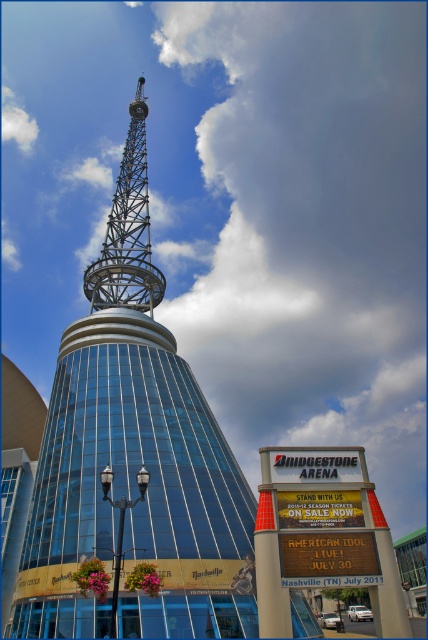
Question: Does metallic structure at upper center appear on the right side of metallic lattice tower at upper center?

Choices:
 (A) no
 (B) yes

Answer: (A)

Question: Which point appears closest to the camera in this image?

Choices:
 (A) (65, 436)
 (B) (116, 296)

Answer: (A)

Question: Can you confirm if metallic structure at upper center is positioned below metallic lattice tower at upper center?

Choices:
 (A) yes
 (B) no

Answer: (A)

Question: Does metallic structure at upper center appear on the right side of metallic lattice tower at upper center?

Choices:
 (A) no
 (B) yes

Answer: (A)

Question: Which of the following is the closest to the observer?

Choices:
 (A) (241, 500)
 (B) (139, 161)

Answer: (A)